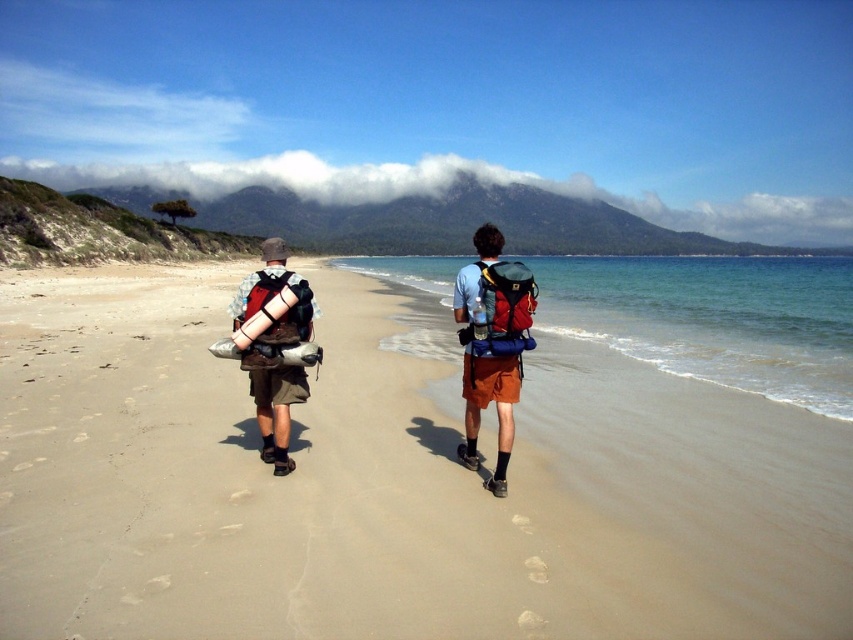
Is beige sand at center positioned at the back of matte blue shirt at center?

That is False.

Does beige sand at center have a larger size compared to matte blue shirt at center?

Correct, beige sand at center is larger in size than matte blue shirt at center.

Which is behind, point (442, 627) or point (506, 454)?

Positioned behind is point (506, 454).

Locate an element on the screen. This screenshot has height=640, width=853. beige sand at center is located at coordinates (381, 486).

Between point (427, 477) and point (421, 275), which one is positioned in front?

Point (427, 477) is more forward.

Who is lower down, beige sand at center or clear water at right?

beige sand at center is below.

This screenshot has width=853, height=640. I want to click on beige sand at center, so click(381, 486).

Is camouflage-patterned backpack at center to the right of matte blue shirt at center from the viewer's perspective?

Incorrect, camouflage-patterned backpack at center is not on the right side of matte blue shirt at center.

Describe the element at coordinates (492, 342) in the screenshot. I see `camouflage-patterned backpack at center` at that location.

The height and width of the screenshot is (640, 853). I want to click on camouflage-patterned backpack at center, so click(492, 342).